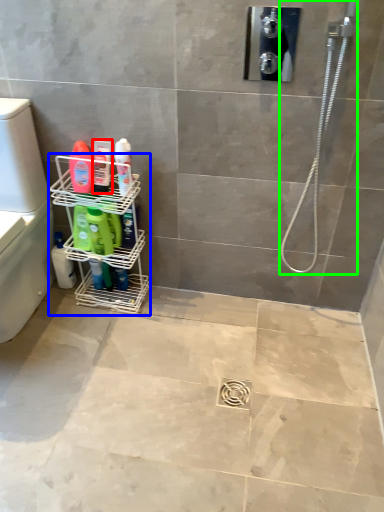
Question: Considering the real-world distances, which object is farthest from toiletry (highlighted by a red box)? shelf (highlighted by a blue box) or shower (highlighted by a green box)?

Choices:
 (A) shelf
 (B) shower

Answer: (B)